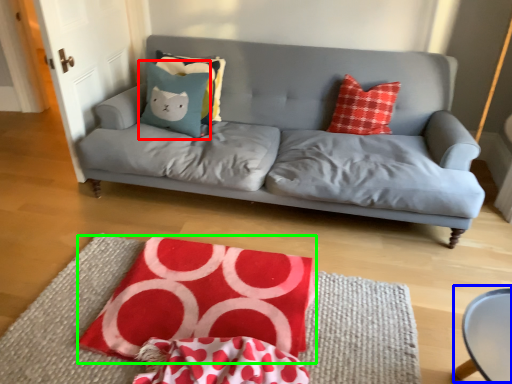
Question: Which object is positioned closest to pillow (highlighted by a red box)? Select from round table (highlighted by a blue box) and quilt (highlighted by a green box).

Choices:
 (A) round table
 (B) quilt

Answer: (B)